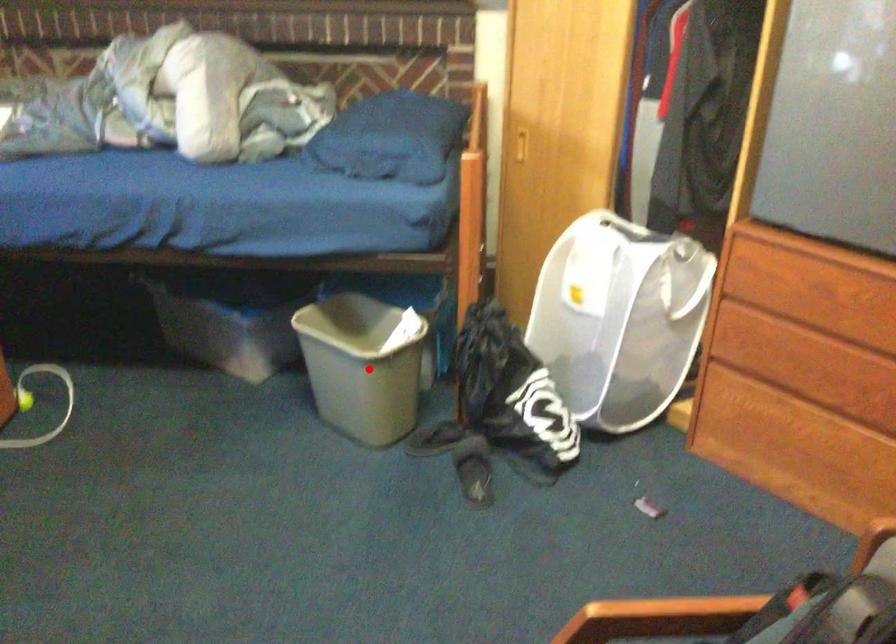
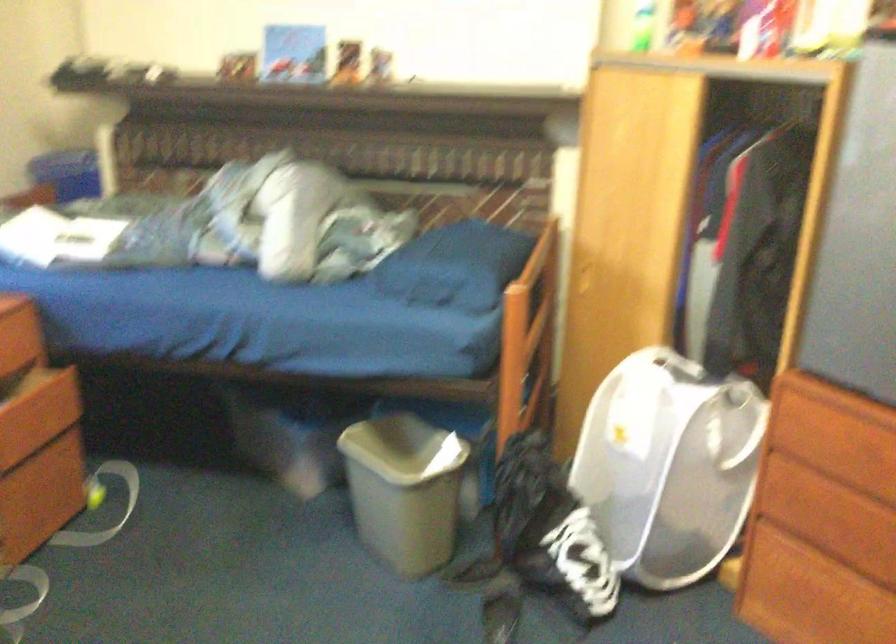
Find the pixel in the second image that matches the highlighted location in the first image.

(403, 489)